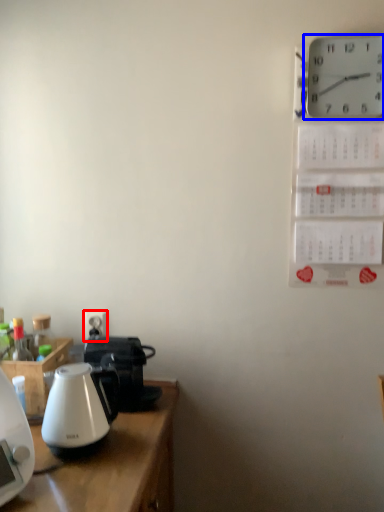
Question: Which point is closer to the camera, electric outlet (highlighted by a red box) or wall clock (highlighted by a blue box)?

Choices:
 (A) electric outlet
 (B) wall clock

Answer: (B)